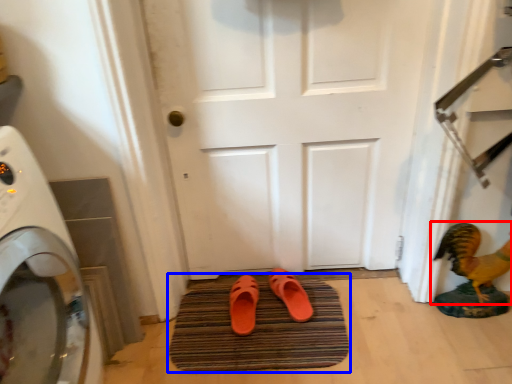
Question: Which object is closer to the camera taking this photo, chicken (highlighted by a red box) or bath mat (highlighted by a blue box)?

Choices:
 (A) chicken
 (B) bath mat

Answer: (A)